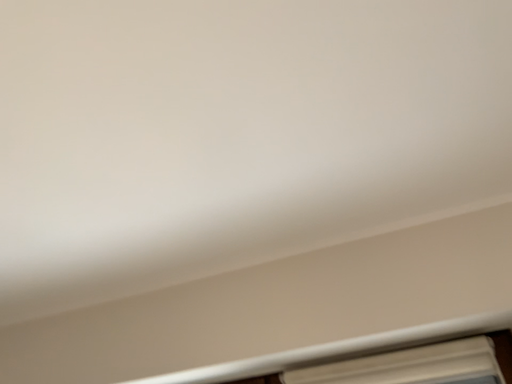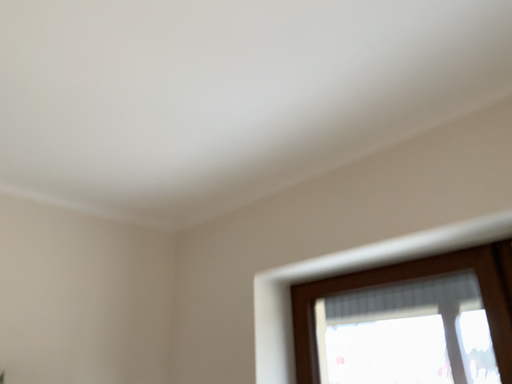
Question: Which way did the camera rotate in the video?

Choices:
 (A) rotated left
 (B) rotated right

Answer: (A)